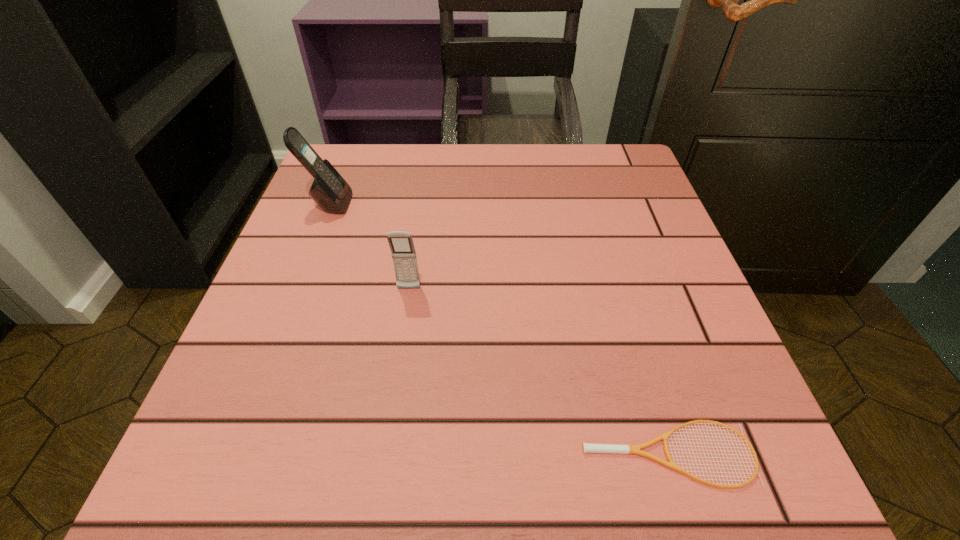
You are a GUI agent. You are given a task and a screenshot of the screen. Output one action in this format:
    pyautogui.click(x=<x>, y=<y>)
    Task: Click on the empty location between the rightmost object and the tallest object
    This screenshot has width=960, height=540.
    Given the screenshot: What is the action you would take?
    click(498, 329)

You are a GUI agent. You are given a task and a screenshot of the screen. Output one action in this format:
    pyautogui.click(x=<x>, y=<y>)
    Task: Click on the free space that is in between the second nearest object and the tallest object
    Image resolution: width=960 pixels, height=540 pixels.
    Given the screenshot: What is the action you would take?
    pyautogui.click(x=369, y=246)

You are a GUI agent. You are given a task and a screenshot of the screen. Output one action in this format:
    pyautogui.click(x=<x>, y=<y>)
    Task: Click on the object that is the closest one to the tennis racket
    
    Given the screenshot: What is the action you would take?
    pyautogui.click(x=401, y=244)

Image resolution: width=960 pixels, height=540 pixels. What are the coordinates of `the second closest object to the right cellular telephone` in the screenshot? It's located at (586, 447).

Locate an element on the screen. The width and height of the screenshot is (960, 540). vacant space that satisfies the following two spatial constraints: 1. on the back side of the rightmost object; 2. on the front-facing side of the farthest object is located at coordinates 593,204.

I want to click on vacant space that satisfies the following two spatial constraints: 1. on the front-facing side of the nearest object; 2. on the right side of the leftmost object, so click(230, 454).

You are a GUI agent. You are given a task and a screenshot of the screen. Output one action in this format:
    pyautogui.click(x=<x>, y=<y>)
    Task: Click on the free location that satisfies the following two spatial constraints: 1. on the front-facing side of the right cellular telephone; 2. on the right side of the tennis racket
    The image size is (960, 540).
    Given the screenshot: What is the action you would take?
    pyautogui.click(x=384, y=454)

Where is `vacant space that satisfies the following two spatial constraints: 1. on the front-facing side of the shorter cellular telephone; 2. on the right side of the tennis racket`? The height and width of the screenshot is (540, 960). vacant space that satisfies the following two spatial constraints: 1. on the front-facing side of the shorter cellular telephone; 2. on the right side of the tennis racket is located at coordinates (384, 454).

This screenshot has height=540, width=960. I want to click on vacant position in the image that satisfies the following two spatial constraints: 1. on the front-facing side of the second nearest object; 2. on the left side of the tennis racket, so click(x=384, y=454).

Locate an element on the screen. free space that satisfies the following two spatial constraints: 1. on the front-facing side of the tennis racket; 2. on the right side of the nearer cellular telephone is located at coordinates (384, 454).